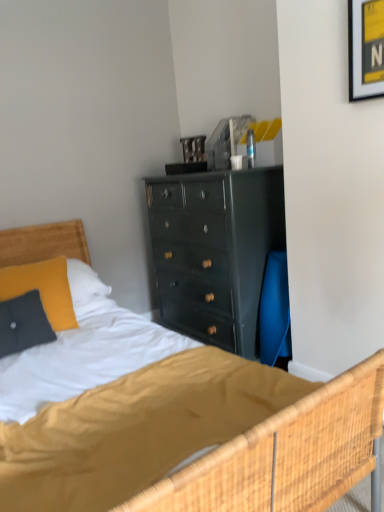
Where is `velvety yellow pillow at left`? The height and width of the screenshot is (512, 384). velvety yellow pillow at left is located at coordinates (43, 289).

In order to face wooden headboard at left, should I rotate leftwards or rightwards?

Rotate left and turn 17.947 degrees.

Find the location of `yellow paper at upper right`. yellow paper at upper right is located at coordinates point(366,49).

You are a GUI agent. You are given a task and a screenshot of the screen. Output one action in this format:
    pyautogui.click(x=<x>, y=<y>)
    Task: Click on the velvety yellow pillow at left
    The image size is (384, 512).
    Given the screenshot: What is the action you would take?
    pyautogui.click(x=43, y=289)

Can you tell me how much yellow paper at upper right and velvety yellow pillow at left differ in facing direction?

66.5 degrees separate the facing orientations of yellow paper at upper right and velvety yellow pillow at left.

Which object is positioned more to the right, yellow paper at upper right or velvety yellow pillow at left?

yellow paper at upper right.

Looking at their sizes, would you say yellow paper at upper right is wider or thinner than velvety yellow pillow at left?

yellow paper at upper right is thinner than velvety yellow pillow at left.

Is wooden headboard at left turned away from velvety yellow pillow at left?

No.

Which of these two, wooden headboard at left or velvety yellow pillow at left, is thinner?

velvety yellow pillow at left is thinner.

From the picture: How distant is wooden headboard at left from velvety yellow pillow at left?

They are 14.89 inches apart.

Which is more to the right, velvety yellow pillow at left or wooden headboard at left?

Positioned to the right is velvety yellow pillow at left.

Based on the photo, from a real-world perspective, is velvety yellow pillow at left positioned under wooden headboard at left based on gravity?

No.

This screenshot has width=384, height=512. I want to click on pillow above the wooden headboard at left (from a real-world perspective), so click(43, 289).

Is wooden headboard at left surrounded by velvety yellow pillow at left?

No, wooden headboard at left is not surrounded by velvety yellow pillow at left.

Can you confirm if velvety yellow pillow at left is smaller than yellow paper at upper right?

No.

Between velvety yellow pillow at left and yellow paper at upper right, which one is positioned in front?

Positioned in front is yellow paper at upper right.

From a real-world perspective, is velvety yellow pillow at left located beneath yellow paper at upper right?

Yes.

Which of these two, velvety yellow pillow at left or yellow paper at upper right, is wider?

velvety yellow pillow at left.

Is wooden headboard at left positioned with its back to yellow paper at upper right?

No.

Which point is more forward, (67, 253) or (365, 45)?

The point (365, 45) is closer.

Is wooden headboard at left not close to yellow paper at upper right?

That's right, there is a large distance between wooden headboard at left and yellow paper at upper right.

Which of these two, yellow paper at upper right or wooden headboard at left, is wider?

wooden headboard at left.

In the scene shown: Would you say yellow paper at upper right is inside or outside wooden headboard at left?

yellow paper at upper right lies outside wooden headboard at left.

Could you tell me if yellow paper at upper right is facing wooden headboard at left?

No, yellow paper at upper right is not turned towards wooden headboard at left.

At what (x,y) coordinates should I click in order to perform the action: click on headboard behind the yellow paper at upper right. Please return your answer as a coordinate pair (x, y). The height and width of the screenshot is (512, 384). Looking at the image, I should click on (43, 243).

Image resolution: width=384 pixels, height=512 pixels. Find the location of `pillow on the left of yellow paper at upper right`. pillow on the left of yellow paper at upper right is located at coordinates (43, 289).

Find the location of `headboard behind the velvety yellow pillow at left`. headboard behind the velvety yellow pillow at left is located at coordinates (43, 243).

Estimate the real-world distances between objects in this image. Which object is closer to velvety yellow pillow at left, wooden headboard at left or yellow paper at upper right?

wooden headboard at left.

When comparing their distances from velvety yellow pillow at left, does yellow paper at upper right or wooden headboard at left seem closer?

wooden headboard at left is positioned closer to the anchor velvety yellow pillow at left.

Considering their positions, is wooden headboard at left positioned further to yellow paper at upper right than velvety yellow pillow at left?

The object further to yellow paper at upper right is wooden headboard at left.

From the image, which object appears to be farther from wooden headboard at left, velvety yellow pillow at left or yellow paper at upper right?

yellow paper at upper right is positioned further to the anchor wooden headboard at left.

Which object lies nearer to the anchor point yellow paper at upper right, velvety yellow pillow at left or wooden headboard at left?

Among the two, velvety yellow pillow at left is located nearer to yellow paper at upper right.

In the scene shown: Considering their positions, is yellow paper at upper right positioned further to wooden headboard at left than velvety yellow pillow at left?

yellow paper at upper right.

At what (x,y) coordinates should I click in order to perform the action: click on pillow situated between wooden headboard at left and yellow paper at upper right from left to right. Please return your answer as a coordinate pair (x, y). The width and height of the screenshot is (384, 512). Looking at the image, I should click on (43, 289).